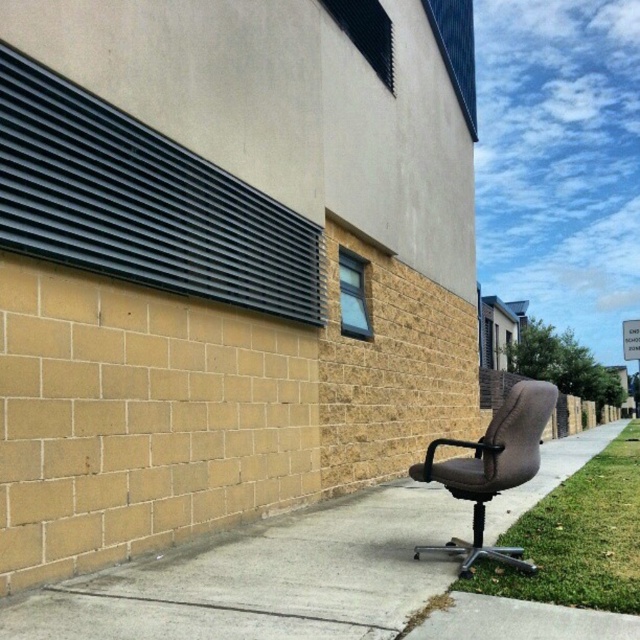
You are a delivery person trying to place a package on the sidewalk between the brown leather chair at right and the green grass at lower right. Based on their sizes, will the package fit between them?

The brown leather chair at right is bigger than the green grass at lower right. Since the chair is larger, there might not be enough space between them to place the package. The package may not fit comfortably between the brown leather chair at right and the green grass at lower right due to the size difference.

You are standing on the sidewalk in front of the beige brick wall. You see a brown leather chair at right and a brown leather office chair at lower right. Which chair is closer to the wall?

The brown leather office chair at lower right is closer to the wall because it is positioned to the right of the brown leather chair at right, which places it nearer to the wall.

You are a delivery person with a box that is 3 feet wide. You need to move the box from the brown leather chair at right to the brown leather office chair at lower right. Can you move the box without tilting it sideways?

The distance between the brown leather chair at right and the brown leather office chair at lower right is 4.30 feet. Since the box is 3 feet wide, it can be moved as the distance is greater than the box width.